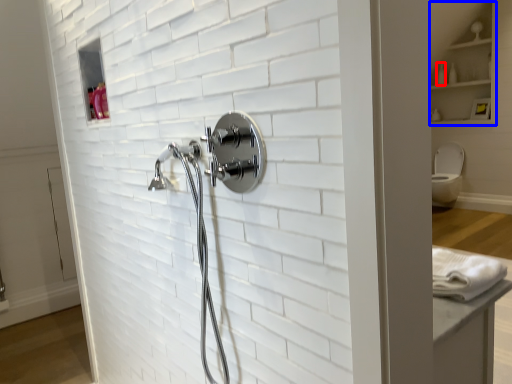
Question: Which point is closer to the camera, toiletry (highlighted by a red box) or cabinet (highlighted by a blue box)?

Choices:
 (A) toiletry
 (B) cabinet

Answer: (B)